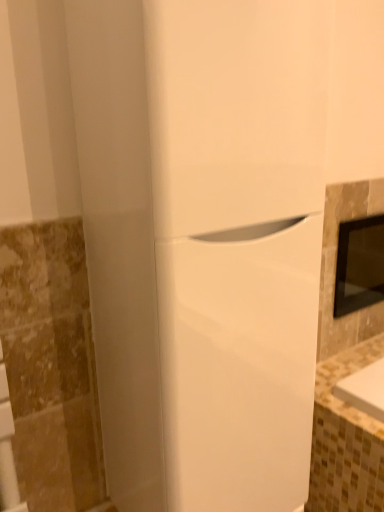
Question: In terms of size, does white glossy refrigerator at center appear bigger or smaller than black glass medicine cabinet at right?

Choices:
 (A) big
 (B) small

Answer: (A)

Question: Is white glossy refrigerator at center inside or outside of black glass medicine cabinet at right?

Choices:
 (A) inside
 (B) outside

Answer: (B)

Question: Is white glossy refrigerator at center taller or shorter than black glass medicine cabinet at right?

Choices:
 (A) tall
 (B) short

Answer: (A)

Question: Is black glass medicine cabinet at right in front of or behind white glossy refrigerator at center in the image?

Choices:
 (A) behind
 (B) front

Answer: (A)

Question: Is point (360, 305) closer or farther from the camera than point (145, 376)?

Choices:
 (A) farther
 (B) closer

Answer: (A)

Question: In terms of width, does black glass medicine cabinet at right look wider or thinner when compared to white glossy refrigerator at center?

Choices:
 (A) wide
 (B) thin

Answer: (B)

Question: Would you say black glass medicine cabinet at right is inside or outside white glossy refrigerator at center?

Choices:
 (A) outside
 (B) inside

Answer: (A)